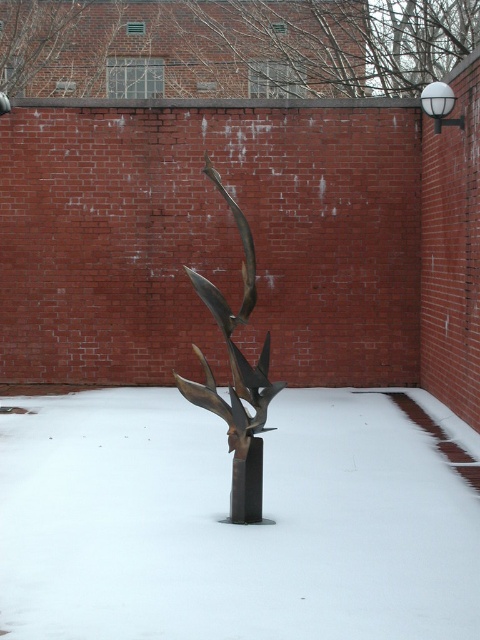
Does white matte snow at center have a greater height compared to bronze pole at center?

Incorrect, white matte snow at center's height is not larger of bronze pole at center's.

Based on the photo, is white matte snow at center closer to camera compared to bronze pole at center?

Yes.

Who is more distant from viewer, [40,529] or [252,484]?

The point [252,484] is more distant.

The width and height of the screenshot is (480, 640). In order to click on white matte snow at center in this screenshot , I will do [230, 524].

Between bronze sculpture at center and bronze pole at center, which one has more height?

Standing taller between the two is bronze sculpture at center.

Where is `bronze sculpture at center`? This screenshot has width=480, height=640. bronze sculpture at center is located at coordinates 236,378.

Does white matte snow at center appear over bronze sculpture at center?

Incorrect, white matte snow at center is not positioned above bronze sculpture at center.

Does white matte snow at center appear on the right side of bronze sculpture at center?

Incorrect, white matte snow at center is not on the right side of bronze sculpture at center.

The height and width of the screenshot is (640, 480). I want to click on white matte snow at center, so click(230, 524).